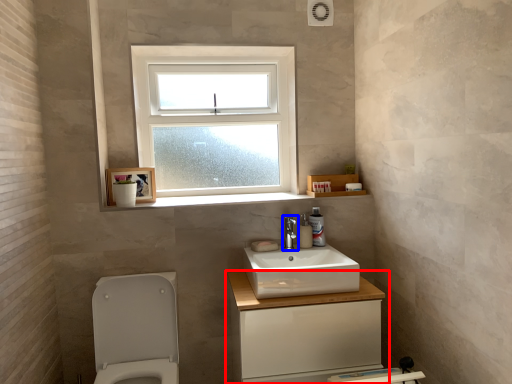
Question: Which point is closer to the camera, bathroom cabinet (highlighted by a red box) or tap (highlighted by a blue box)?

Choices:
 (A) bathroom cabinet
 (B) tap

Answer: (A)